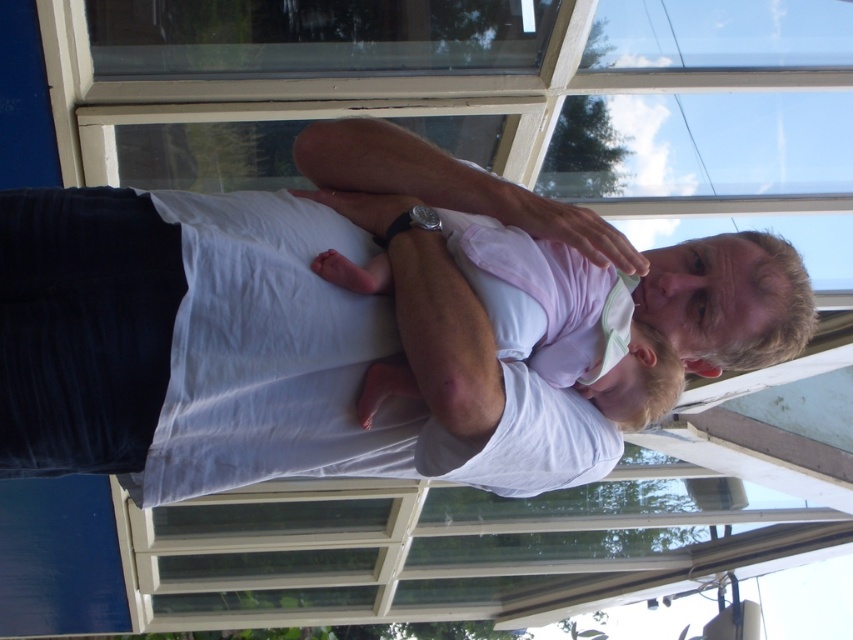
Question: Which point appears closest to the camera in this image?

Choices:
 (A) (282, 257)
 (B) (569, 276)

Answer: (A)

Question: Which point is farther from the camera taking this photo?

Choices:
 (A) (212, 307)
 (B) (500, 316)

Answer: (B)

Question: Is white cotton shirt at center wider than pink fabric baby at center?

Choices:
 (A) yes
 (B) no

Answer: (A)

Question: Is white cotton shirt at center above pink fabric baby at center?

Choices:
 (A) yes
 (B) no

Answer: (A)

Question: Does white cotton shirt at center come in front of pink fabric baby at center?

Choices:
 (A) no
 (B) yes

Answer: (B)